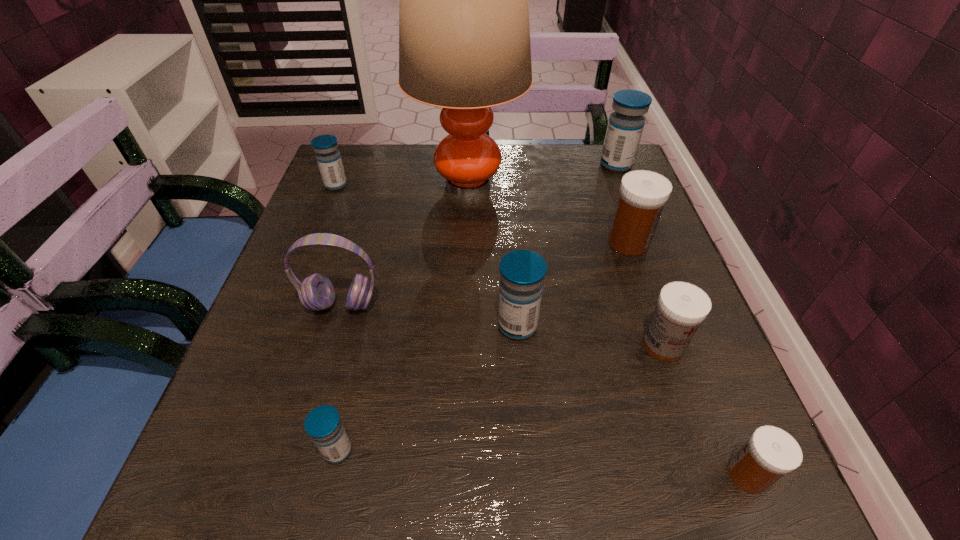
At what (x,y) coordinates should I click in order to perform the action: click on vacant space at the far edge of the desktop. Please return your answer as a coordinate pair (x, y). Looking at the image, I should click on coord(566,186).

This screenshot has width=960, height=540. Find the location of `free location at the near edge`. free location at the near edge is located at coordinates (642, 457).

Find the location of a particular element. The height and width of the screenshot is (540, 960). vacant space at the left edge is located at coordinates (299, 442).

In the image, there is a desktop. What are the coordinates of `vacant space at the right edge` in the screenshot? It's located at (639, 430).

The width and height of the screenshot is (960, 540). What are the coordinates of `vacant space at the near left corner of the desktop` in the screenshot? It's located at (285, 473).

I want to click on free region at the far right corner of the desktop, so click(593, 167).

In the image, there is a desktop. Where is `free space at the near right corner`? The height and width of the screenshot is (540, 960). free space at the near right corner is located at coordinates (693, 509).

You are a GUI agent. You are given a task and a screenshot of the screen. Output one action in this format:
    pyautogui.click(x=<x>, y=<y>)
    Task: Click on the free space between the second farthest white medicine and the sixth medicine from right to left
    
    Given the screenshot: What is the action you would take?
    pyautogui.click(x=500, y=397)

The image size is (960, 540). What are the coordinates of `free point between the third farthest blue medicine and the tallest object` in the screenshot? It's located at (492, 255).

Where is `vacant area that lies between the rightmost blue medicine and the second medicine from left to right`? This screenshot has width=960, height=540. vacant area that lies between the rightmost blue medicine and the second medicine from left to right is located at coordinates (477, 307).